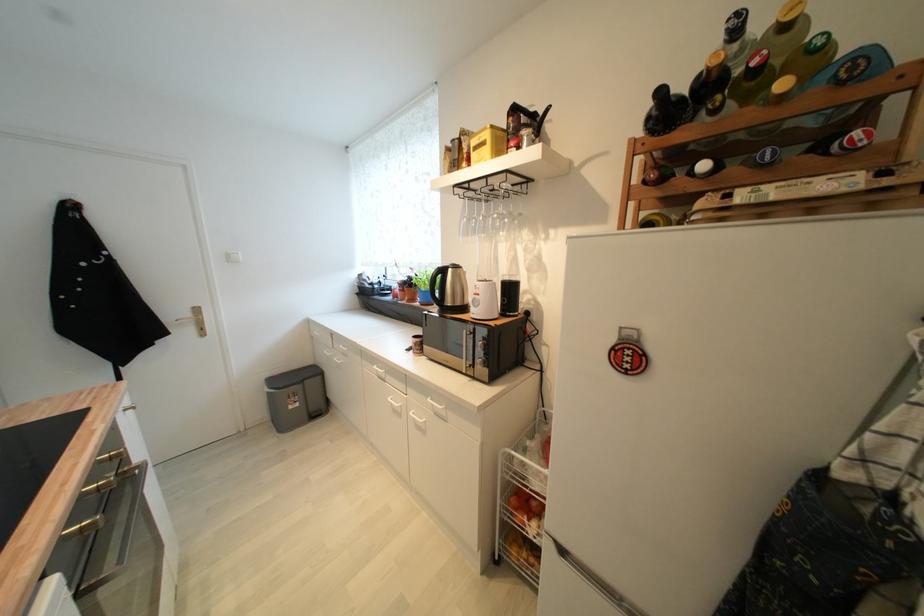
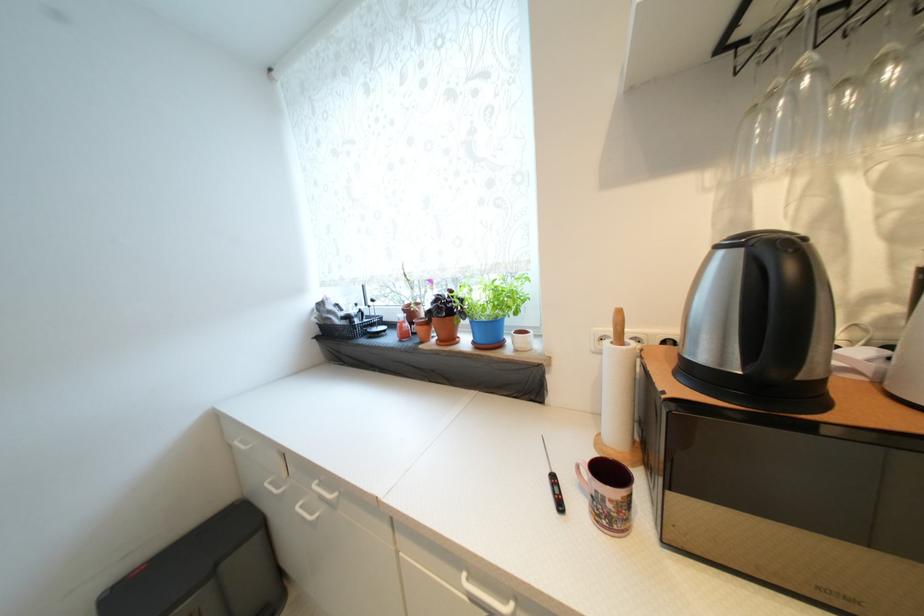
The point at (x=321, y=334) is marked in the first image. Where is the corresponding point in the second image?

(242, 445)